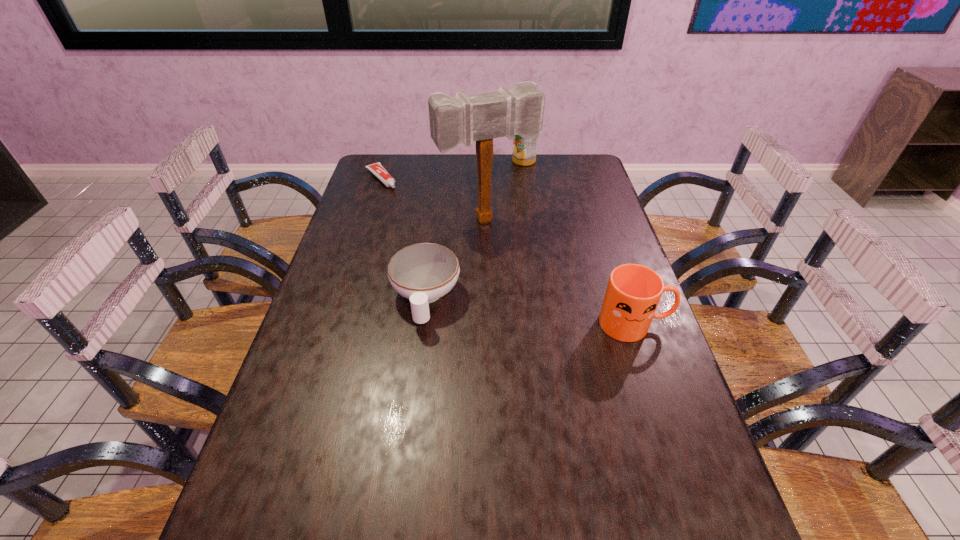
The width and height of the screenshot is (960, 540). What are the coordinates of `vacant space positioned 0.190m on the front label of the second tallest object` in the screenshot? It's located at (531, 193).

I want to click on vacant point located 0.330m on the front label of the second tallest object, so click(x=536, y=215).

Identify the location of blank area located on the front label of the second tallest object. Image resolution: width=960 pixels, height=540 pixels. (530, 190).

Where is `vacant point located 0.350m at the head of the third nearest object`? The image size is (960, 540). vacant point located 0.350m at the head of the third nearest object is located at coordinates (550, 312).

Find the location of a particular element. This screenshot has height=540, width=960. vacant space situated 0.110m at the head of the third nearest object is located at coordinates (516, 256).

The image size is (960, 540). Find the location of `free space located 0.310m at the head of the third nearest object`. free space located 0.310m at the head of the third nearest object is located at coordinates (543, 301).

Locate an element on the screen. Image resolution: width=960 pixels, height=540 pixels. free space located 0.260m at the nozzle of the leftmost object is located at coordinates (421, 225).

Find the location of `free space located at the nozzle of the leftmost object`. free space located at the nozzle of the leftmost object is located at coordinates (431, 235).

Find the location of a particular element. The height and width of the screenshot is (540, 960). vacant space situated at the nozzle of the leftmost object is located at coordinates (398, 201).

The image size is (960, 540). I want to click on fruit juice positioned at the far edge, so click(x=524, y=151).